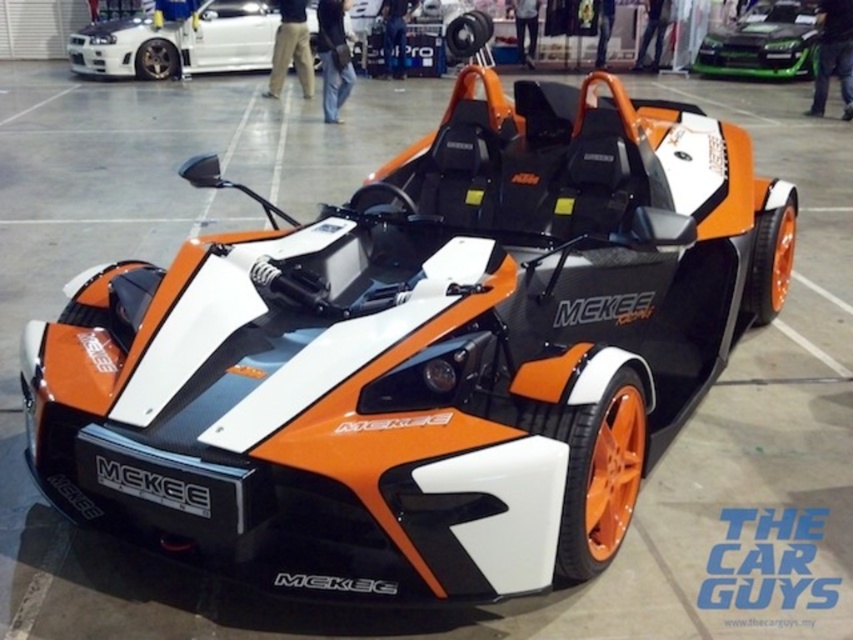
Is point (259, 61) farther from camera compared to point (753, 61)?

That is True.

Which is above, white glossy sedan at upper left or green glossy car at upper center?

Positioned higher is green glossy car at upper center.

Is point (234, 10) farther from camera compared to point (732, 67)?

No, (234, 10) is in front of (732, 67).

Image resolution: width=853 pixels, height=640 pixels. In order to click on white glossy sedan at upper left in this screenshot , I will do `click(126, 49)`.